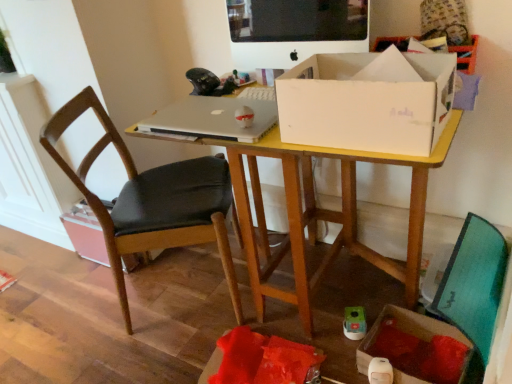
Question: In the image, is yellow wood desk at center on the left side or the right side of matte black monitor at upper center?

Choices:
 (A) right
 (B) left

Answer: (A)

Question: Is yellow wood desk at center bigger or smaller than matte black monitor at upper center?

Choices:
 (A) small
 (B) big

Answer: (B)

Question: Estimate the real-world distances between objects in this image. Which object is farther from the matte black monitor at upper center?

Choices:
 (A) black leather chair at left
 (B) silver metallic laptop at center
 (C) cardboard box at lower right, the 1th cardboard box positioned from the right
 (D) yellow wood desk at center
 (E) white cardboard box at center

Answer: (C)

Question: Considering the real-world distances, which object is farthest from the cardboard box at lower right, the 2th cardboard box positioned from the back?

Choices:
 (A) black leather chair at left, which is the 2th cardboard box from front to back
 (B) yellow wood desk at center
 (C) white cardboard box at center
 (D) black leather chair at left
 (E) silver metallic laptop at center

Answer: (A)